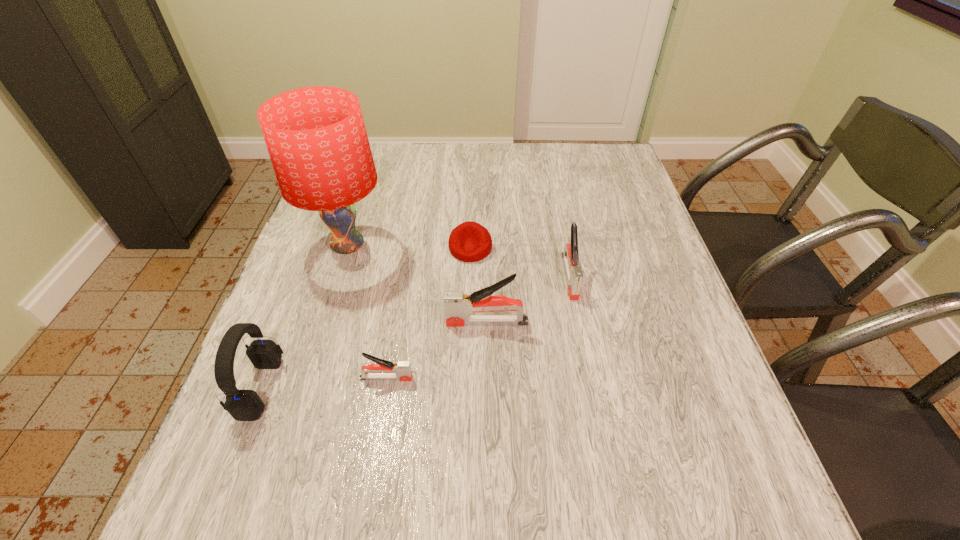
Please show where to add a stapler on the right while keeping spacing even. Please provide its 2D coordinates. Your answer should be formatted as a tuple, i.e. [(x, y)], where the tuple contains the x and y coordinates of a point satisfying the conditions above.

[(638, 238)]